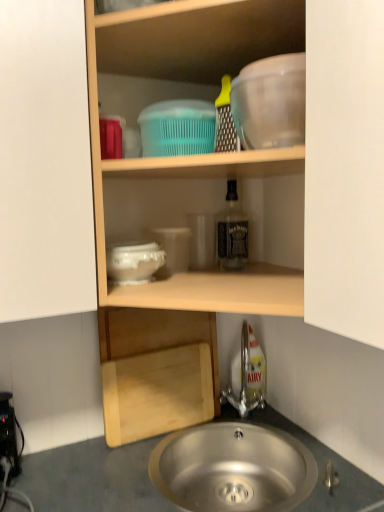
Question: Is clear glass bottle at center inside silver metallic tap at lower center?

Choices:
 (A) no
 (B) yes

Answer: (A)

Question: Does silver metallic tap at lower center have a lesser width compared to clear glass bottle at center?

Choices:
 (A) yes
 (B) no

Answer: (B)

Question: Is silver metallic tap at lower center to the left of clear glass bottle at center from the viewer's perspective?

Choices:
 (A) no
 (B) yes

Answer: (A)

Question: Is silver metallic tap at lower center wider than clear glass bottle at center?

Choices:
 (A) no
 (B) yes

Answer: (B)

Question: From a real-world perspective, is silver metallic tap at lower center over clear glass bottle at center?

Choices:
 (A) yes
 (B) no

Answer: (B)

Question: Is silver metallic tap at lower center placed right next to clear glass bottle at center?

Choices:
 (A) yes
 (B) no

Answer: (B)

Question: Are transparent plastic mixing bowl at upper right and white glossy bowl at center, the 1th basin from the bottom, beside each other?

Choices:
 (A) yes
 (B) no

Answer: (B)

Question: Is transparent plastic mixing bowl at upper right facing away from white glossy bowl at center, marked as the second basin in a top-to-bottom arrangement?

Choices:
 (A) no
 (B) yes

Answer: (A)

Question: Is transparent plastic mixing bowl at upper right to the right of white glossy bowl at center, marked as the second basin in a top-to-bottom arrangement, from the viewer's perspective?

Choices:
 (A) yes
 (B) no

Answer: (A)

Question: Can you confirm if transparent plastic mixing bowl at upper right is bigger than white glossy bowl at center, the 1th basin from the bottom?

Choices:
 (A) no
 (B) yes

Answer: (B)

Question: From a real-world perspective, is transparent plastic mixing bowl at upper right under white glossy bowl at center, marked as the second basin in a top-to-bottom arrangement?

Choices:
 (A) no
 (B) yes

Answer: (A)

Question: Can you confirm if transparent plastic mixing bowl at upper right is positioned to the left of white glossy bowl at center, the 1th basin from the bottom?

Choices:
 (A) yes
 (B) no

Answer: (B)

Question: From a real-world perspective, does white glossy bowl at center, the 1th basin from the bottom, stand above smooth gray countertop at lower center?

Choices:
 (A) no
 (B) yes

Answer: (B)